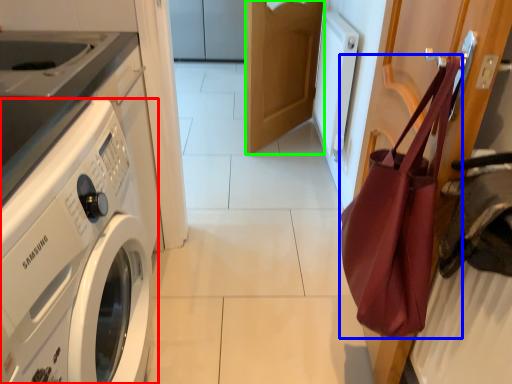
Question: Which is nearer to the washing machine (highlighted by a red box)? tote bag (highlighted by a blue box) or door (highlighted by a green box).

Choices:
 (A) tote bag
 (B) door

Answer: (A)